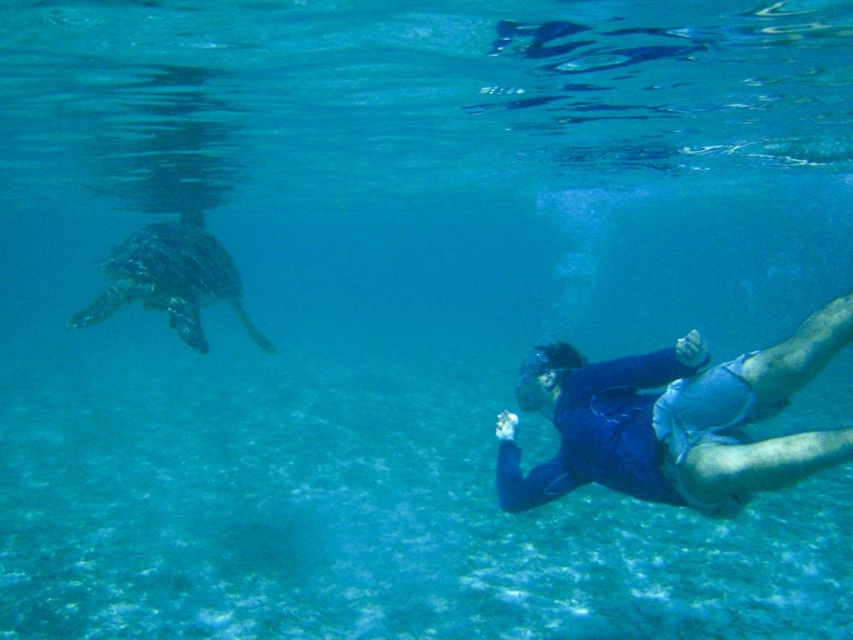
You are a marine biologist studying underwater formations. You notice a point at coordinates (675,420) in the image. Based on the scene description, what object is located at that point?

The point at coordinates (675,420) corresponds to the blue fabric diver at lower right.

You are a scuba diver who wants to reach the nearest point between point (721, 512) and point (239, 282). Which point should you swim towards?

Point (721, 512) is closer to the viewer than point (239, 282), so you should swim towards point (721, 512) to reach the nearest point.

You are a marine biologist observing the underwater scene. You notice the blue fabric diver at lower right and the green textured turtle at left. Which object is positioned closer to you, the observer?

The blue fabric diver at lower right is closer to the viewer than the green textured turtle at left.